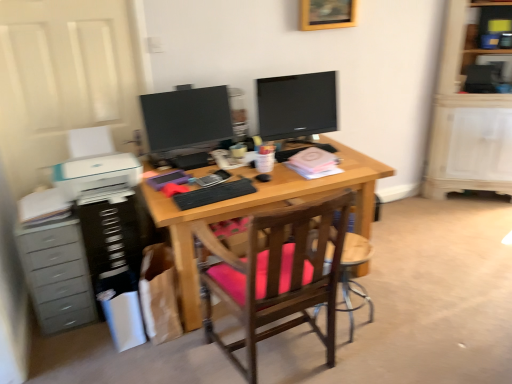
Identify the location of vacant area that is in front of wooden chair at center. The image size is (512, 384). (357, 363).